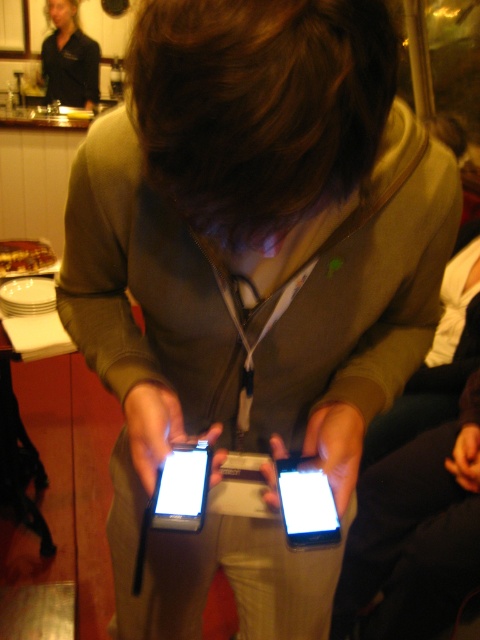
You are a photographer at a conference event. You need to take a photo of the black glossy smartphone at center without including the black shirt at upper left in the frame. Is this possible based on their positions?

The black shirt at upper left is further to the viewer than the black glossy smartphone at center. Therefore, the smartphone is behind the shirt, so it would be possible to frame the photo to exclude the shirt by focusing on the area behind it where the smartphone is located.

You are standing in a room and see a person wearing a green zip up jacket and beige pants. There is also a point at (69, 58). What is located at that point?

The point at (69, 58) corresponds to the black shirt at upper left.